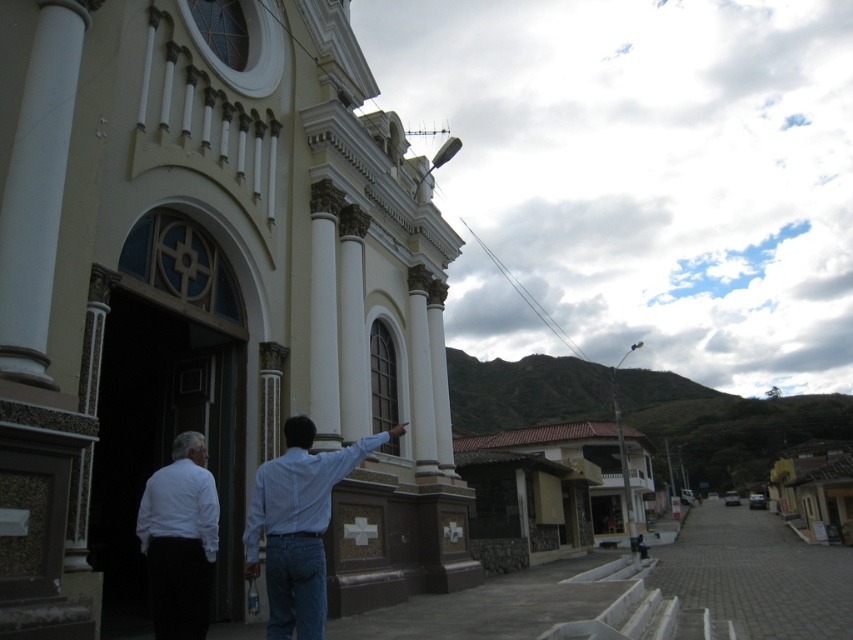
Question: Is light blue shirt at center thinner than white matte shirt at lower left?

Choices:
 (A) no
 (B) yes

Answer: (A)

Question: Which of the following is the farthest from the observer?

Choices:
 (A) light blue shirt at center
 (B) beige stone church at center

Answer: (A)

Question: Is beige stone church at center smaller than white matte shirt at lower left?

Choices:
 (A) yes
 (B) no

Answer: (B)

Question: Is beige stone church at center above light blue shirt at center?

Choices:
 (A) no
 (B) yes

Answer: (B)

Question: Which is nearer to the white matte shirt at lower left?

Choices:
 (A) light blue shirt at center
 (B) beige stone church at center

Answer: (A)

Question: Which point is farther to the camera?

Choices:
 (A) white matte shirt at lower left
 (B) light blue shirt at center
 (C) beige stone church at center

Answer: (A)